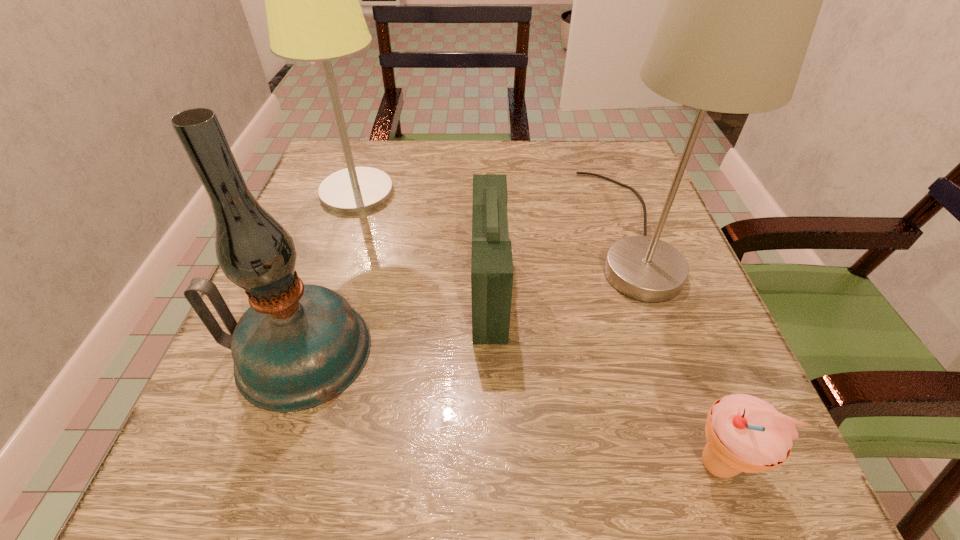
Locate an element on the screen. The width and height of the screenshot is (960, 540). free spot located 0.330m on the front-facing side of the first-aid kit is located at coordinates (289, 290).

The height and width of the screenshot is (540, 960). What are the coordinates of `free space located on the front-facing side of the first-aid kit` in the screenshot? It's located at (390, 290).

Where is `vacant space located 0.400m on the back of the nearest object`? The image size is (960, 540). vacant space located 0.400m on the back of the nearest object is located at coordinates (635, 239).

Find the location of `object at the near edge`. object at the near edge is located at coordinates coord(744,433).

You are a GUI agent. You are given a task and a screenshot of the screen. Output one action in this format:
    pyautogui.click(x=<x>, y=<y>)
    Task: Click on the table lamp that is at the left edge
    The image size is (960, 540).
    Given the screenshot: What is the action you would take?
    pyautogui.click(x=313, y=14)

Where is `oil lamp located at the left edge`? This screenshot has width=960, height=540. oil lamp located at the left edge is located at coordinates (297, 346).

Where is `table lamp situated at the right edge`? This screenshot has width=960, height=540. table lamp situated at the right edge is located at coordinates (744, 0).

Where is `icecream that is at the right edge`? Image resolution: width=960 pixels, height=540 pixels. icecream that is at the right edge is located at coordinates (744, 433).

In order to click on object present at the far left corner in this screenshot , I will do `click(313, 14)`.

This screenshot has height=540, width=960. What are the coordinates of `object that is at the far right corner` in the screenshot? It's located at (744, 0).